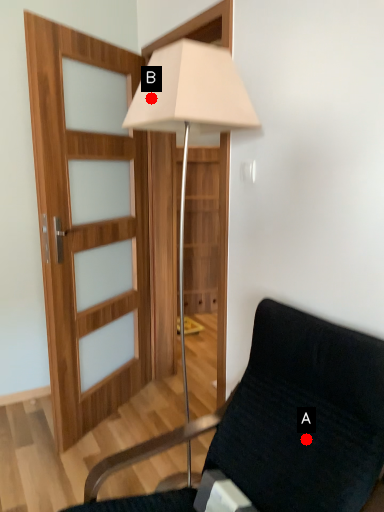
Question: Two points are circled on the image, labeled by A and B beside each circle. Which point is closer to the camera taking this photo?

Choices:
 (A) A is closer
 (B) B is closer

Answer: (A)